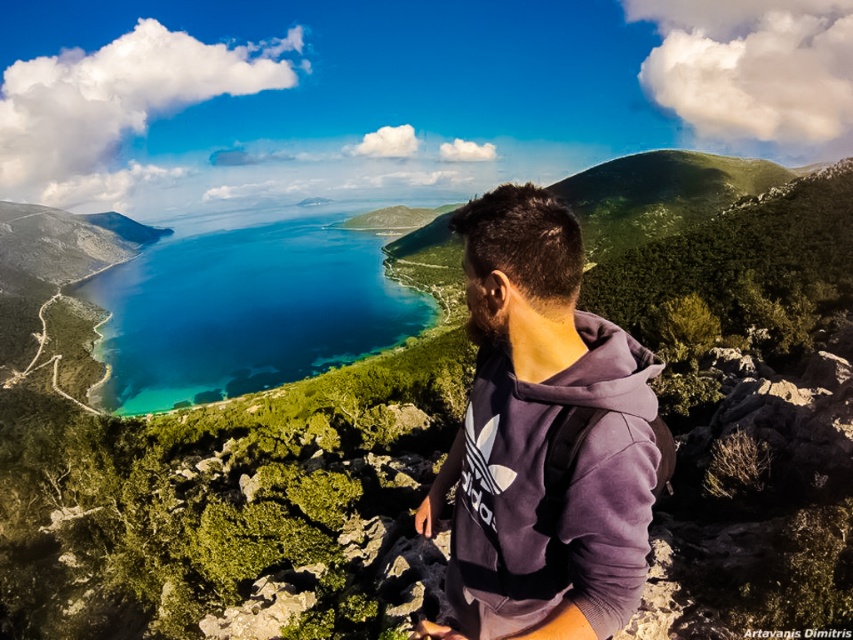
Can you confirm if purple fleece jacket at center is bigger than blue crystal clear water at center?

No, purple fleece jacket at center is not bigger than blue crystal clear water at center.

Is purple fleece jacket at center thinner than blue crystal clear water at center?

Yes.

Between point (567, 605) and point (138, 326), which one is positioned in front?

Point (567, 605) is more forward.

Find the location of `purple fleece jacket at center`. purple fleece jacket at center is located at coordinates (543, 438).